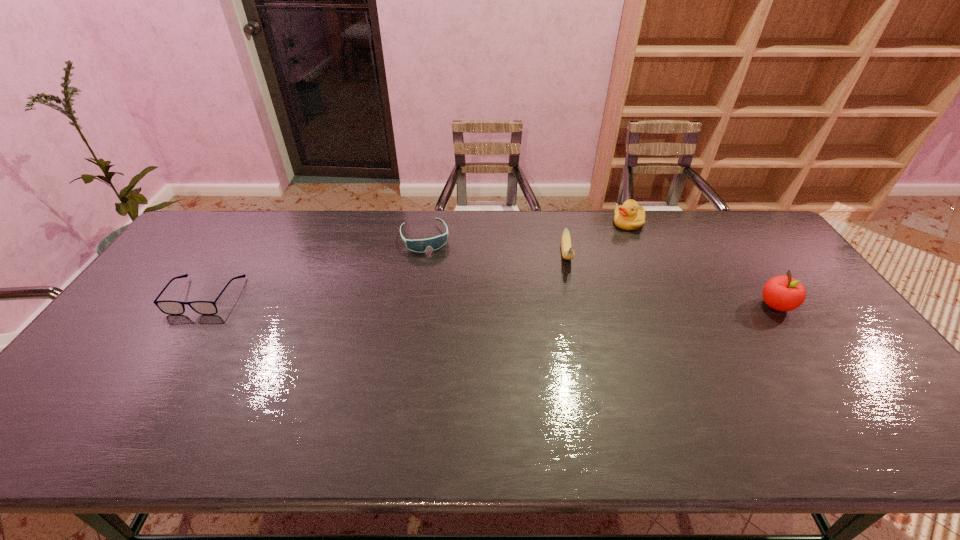
The height and width of the screenshot is (540, 960). In order to click on object that is positioned at the left edge in this screenshot , I will do `click(168, 307)`.

Where is `object that is at the right edge`? object that is at the right edge is located at coordinates (783, 293).

Image resolution: width=960 pixels, height=540 pixels. In the image, there is a desktop. In order to click on vacant space at the far edge in this screenshot , I will do `click(503, 231)`.

Where is `vacant space at the left edge of the desktop`? This screenshot has height=540, width=960. vacant space at the left edge of the desktop is located at coordinates (164, 295).

You are a GUI agent. You are given a task and a screenshot of the screen. Output one action in this format:
    pyautogui.click(x=<x>, y=<y>)
    Task: Click on the free location at the right edge of the desktop
    The width and height of the screenshot is (960, 540).
    Given the screenshot: What is the action you would take?
    pyautogui.click(x=755, y=267)

Find the location of `free location at the far left corner of the desktop`. free location at the far left corner of the desktop is located at coordinates (223, 237).

The image size is (960, 540). In the image, there is a desktop. What are the coordinates of `vacant space at the near left corner` in the screenshot? It's located at (84, 389).

The image size is (960, 540). Find the location of `free location at the far right corner`. free location at the far right corner is located at coordinates (779, 248).

Locate an element on the screen. The height and width of the screenshot is (540, 960). vacant space that's between the goggles and the spectacles is located at coordinates (315, 266).

Where is `unoccupied position between the second object from right to left and the third object from left to right`? The width and height of the screenshot is (960, 540). unoccupied position between the second object from right to left and the third object from left to right is located at coordinates (597, 239).